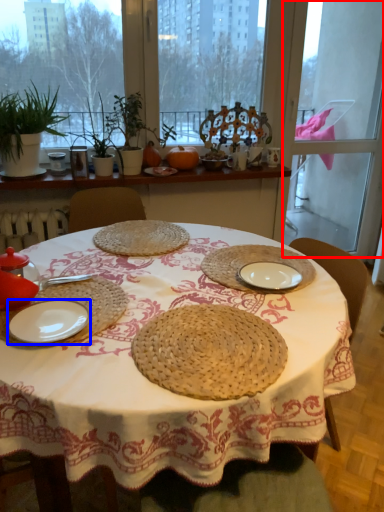
Question: Which point is further to the camera, screen door (highlighted by a red box) or plate (highlighted by a blue box)?

Choices:
 (A) screen door
 (B) plate

Answer: (A)